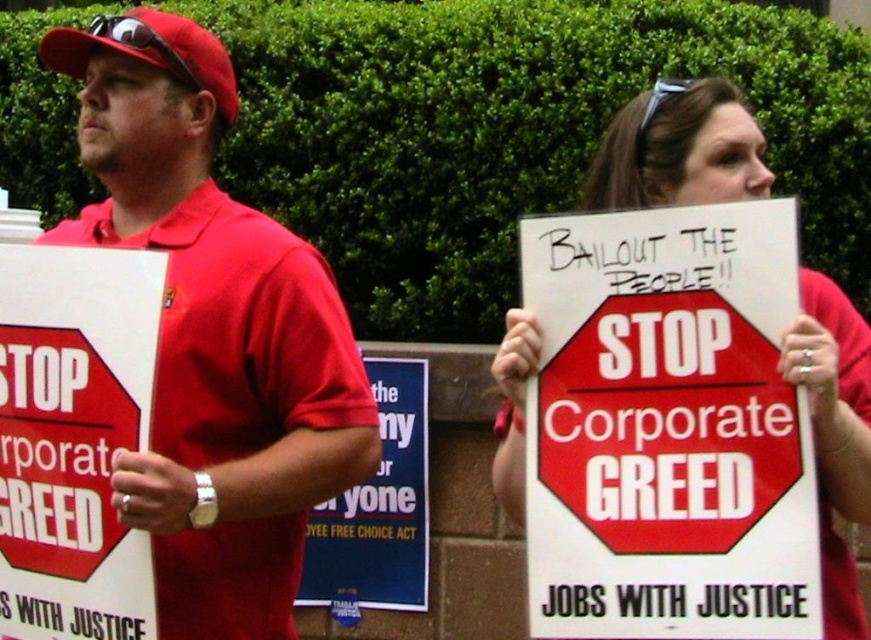
You are a photographer trying to capture both the matte red stop sign at left and the matte white sign at center in a single frame. Given their sizes, which sign should you focus on to ensure both are fully visible without cropping?

The matte red stop sign at left is taller than the matte white sign at center. To ensure both are fully visible, focus on the taller matte red stop sign at left, adjusting the camera angle to include the smaller matte white sign at center in the frame.

What is the exact coordinate of the matte red stop sign at left in the image?

The matte red stop sign at left is located at point (73, 438).

You are a photographer at the protest and want to capture a photo where both the matte red shirt at left and the matte red baseball cap at upper left are visible. Based on their positions, which object should be closer to the left side of the photo?

The matte red baseball cap at upper left is positioned to the left of the matte red shirt at left, so it should be closer to the left side of the photo.